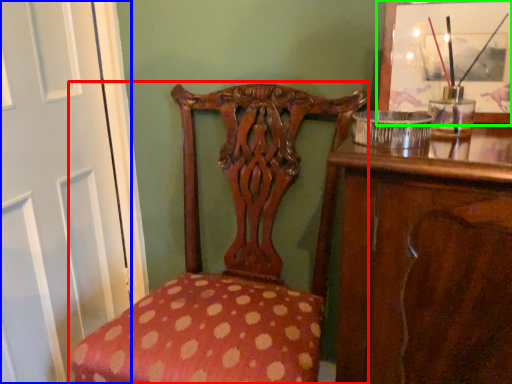
Question: Based on their relative distances, which object is farther from chair (highlighted by a red box)? Choose from screen door (highlighted by a blue box) and picture frame (highlighted by a green box).

Choices:
 (A) screen door
 (B) picture frame

Answer: (B)